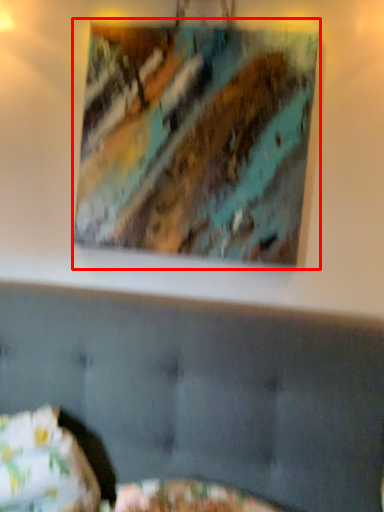
Question: Where is picture frame (annotated by the red box) located in relation to pillow in the image?

Choices:
 (A) right
 (B) left

Answer: (A)